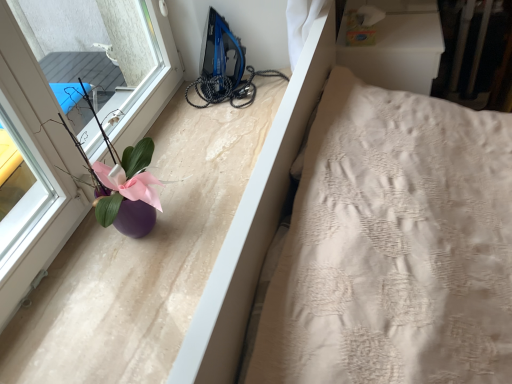
The height and width of the screenshot is (384, 512). What do you see at coordinates (123, 186) in the screenshot?
I see `purple glossy vase at left` at bounding box center [123, 186].

Measure the distance between point (109, 191) and camera.

The depth of point (109, 191) is 3.35 feet.

The height and width of the screenshot is (384, 512). Identify the location of purple glossy vase at left. (123, 186).

You are a GUI agent. You are given a task and a screenshot of the screen. Output one action in this format:
    pyautogui.click(x=<x>, y=<y>)
    Task: Click on the purple matte vase at left
    Image resolution: width=512 pixels, height=384 pixels.
    Given the screenshot: What is the action you would take?
    pyautogui.click(x=35, y=169)

This screenshot has height=384, width=512. Describe the element at coordinates (35, 169) in the screenshot. I see `purple matte vase at left` at that location.

What is the approximate width of purple matte vase at left?

1.49 inches.

The image size is (512, 384). In order to click on purple glossy vase at left in this screenshot , I will do `click(123, 186)`.

Looking at this image, is purple matte vase at left at the left side of purple glossy vase at left?

Yes, purple matte vase at left is to the left of purple glossy vase at left.

Which is behind, purple matte vase at left or purple glossy vase at left?

purple glossy vase at left is further away from the camera.

Considering the points (128, 98) and (104, 178), which point is behind, point (128, 98) or point (104, 178)?

The point (128, 98) is more distant.

From the image's perspective, who appears lower, purple matte vase at left or purple glossy vase at left?

purple glossy vase at left, from the image's perspective.

From a real-world perspective, is purple matte vase at left positioned under purple glossy vase at left based on gravity?

No, from a real-world perspective, purple matte vase at left is not beneath purple glossy vase at left.

Looking at their sizes, would you say purple matte vase at left is wider or thinner than purple glossy vase at left?

In the image, purple matte vase at left appears to be more narrow than purple glossy vase at left.

Can you confirm if purple matte vase at left is shorter than purple glossy vase at left?

In fact, purple matte vase at left may be taller than purple glossy vase at left.

Does purple matte vase at left have a smaller size compared to purple glossy vase at left?

No.

Is purple matte vase at left spatially inside purple glossy vase at left, or outside of it?

The correct answer is: outside.

Does purple matte vase at left touch purple glossy vase at left?

No.

Does purple matte vase at left turn towards purple glossy vase at left?

Yes.

What's the angular difference between purple matte vase at left and purple glossy vase at left's facing directions?

The angle between the facing direction of purple matte vase at left and the facing direction of purple glossy vase at left is 3.39 degrees.

How distant is purple matte vase at left from purple glossy vase at left?

6.64 inches.

This screenshot has height=384, width=512. In order to click on floral arrangement that appears below the purple matte vase at left (from a real-world perspective) in this screenshot , I will do `click(123, 186)`.

Between purple glossy vase at left and purple matte vase at left, which one appears on the right side from the viewer's perspective?

From the viewer's perspective, purple glossy vase at left appears more on the right side.

Which object is closer to the camera, purple glossy vase at left or purple matte vase at left?

purple matte vase at left is in front.

Considering the positions of point (126, 228) and point (17, 224), is point (126, 228) closer or farther from the camera than point (17, 224)?

Clearly, point (126, 228) is more distant from the camera than point (17, 224).

From the image's perspective, is purple glossy vase at left below purple matte vase at left?

Yes, from the image's perspective, purple glossy vase at left is beneath purple matte vase at left.

From a real-world perspective, which is physically below, purple glossy vase at left or purple matte vase at left?

In real-world perspective, purple glossy vase at left is lower.

Is purple glossy vase at left thinner than purple matte vase at left?

No, purple glossy vase at left is not thinner than purple matte vase at left.

Who is shorter, purple glossy vase at left or purple matte vase at left?

With less height is purple glossy vase at left.

In the scene shown: Which of these two, purple glossy vase at left or purple matte vase at left, is bigger?

purple matte vase at left.

Is purple glossy vase at left completely or partially outside of purple matte vase at left?

Yes.

Can you see purple glossy vase at left touching purple matte vase at left?

No, purple glossy vase at left is not making contact with purple matte vase at left.

Is purple glossy vase at left facing away from purple matte vase at left?

Yes.

Where is `floral arrangement below the purple matte vase at left (from a real-world perspective)`? floral arrangement below the purple matte vase at left (from a real-world perspective) is located at coordinates (123, 186).

This screenshot has width=512, height=384. Find the location of `floral arrangement located below the purple matte vase at left (from the image's perspective)`. floral arrangement located below the purple matte vase at left (from the image's perspective) is located at coordinates (123, 186).

Locate an element on the screen. Image resolution: width=512 pixels, height=384 pixels. window lying on the left of purple glossy vase at left is located at coordinates (35, 169).